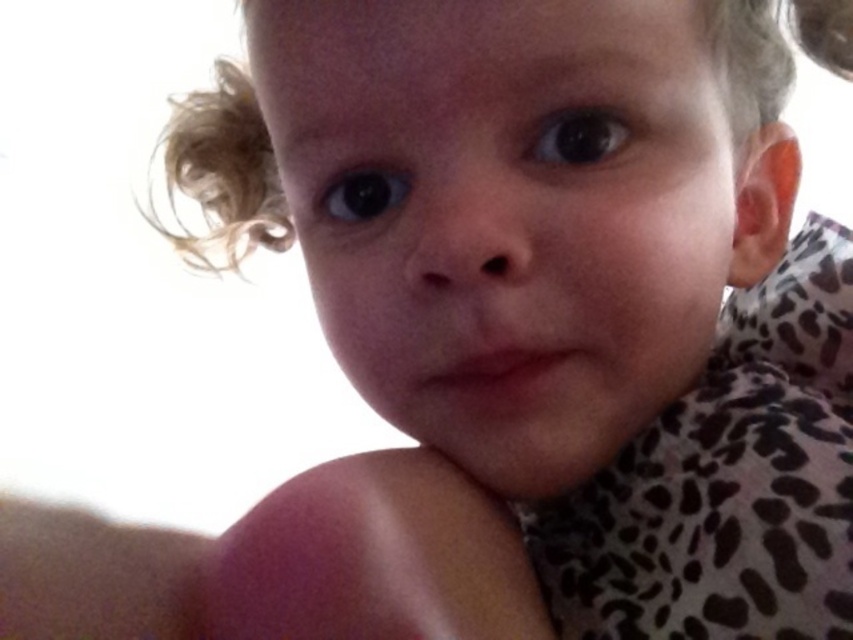
Based on the scene description, where is the smooth skin face at center located in the image?

The smooth skin face at center is located at point coordinates of approximately 0.338 on the x axis and 0.593 on the y axis.